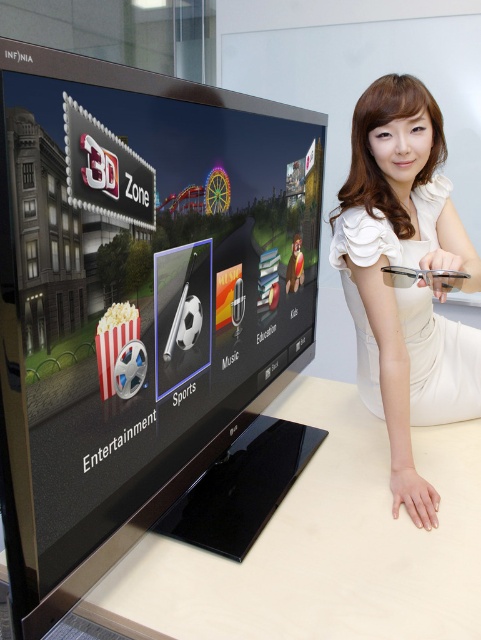
Question: Does matte black soccer ball at center have a smaller size compared to white glossy table at lower center?

Choices:
 (A) no
 (B) yes

Answer: (A)

Question: Considering the real-world distances, which object is farthest from the white satin dress at right?

Choices:
 (A) white glossy table at lower center
 (B) white paper popcorn at center
 (C) matte black soccer ball at center

Answer: (B)

Question: Based on their relative distances, which object is farther from the white paper popcorn at center?

Choices:
 (A) white satin dress at right
 (B) white glossy table at lower center

Answer: (A)

Question: Considering the relative positions of white glossy table at lower center and white paper popcorn at center in the image provided, where is white glossy table at lower center located with respect to white paper popcorn at center?

Choices:
 (A) left
 (B) right

Answer: (B)

Question: Among these points, which one is nearest to the camera?

Choices:
 (A) (126, 310)
 (B) (379, 134)
 (C) (51, 260)

Answer: (C)

Question: Does matte black soccer ball at center come behind white satin dress at right?

Choices:
 (A) no
 (B) yes

Answer: (A)